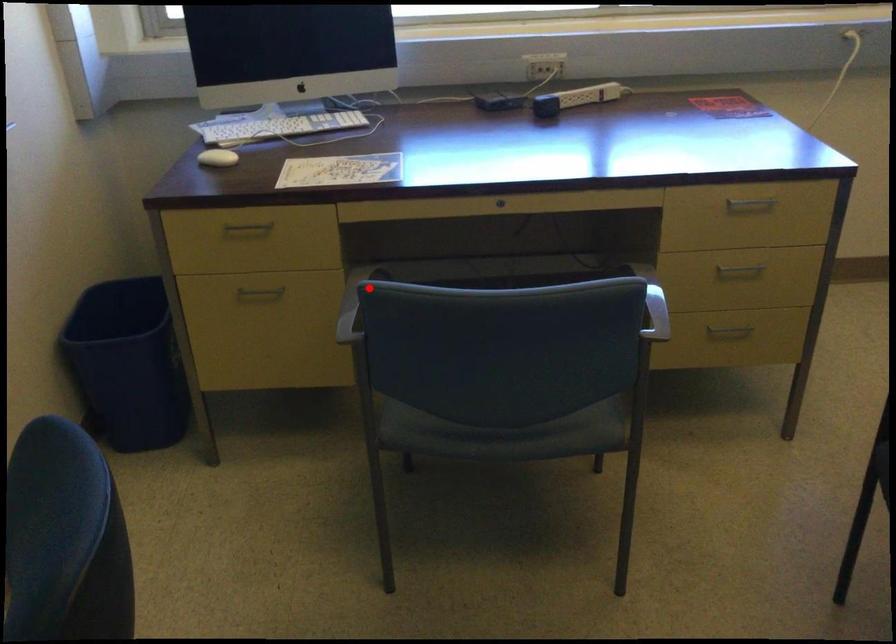
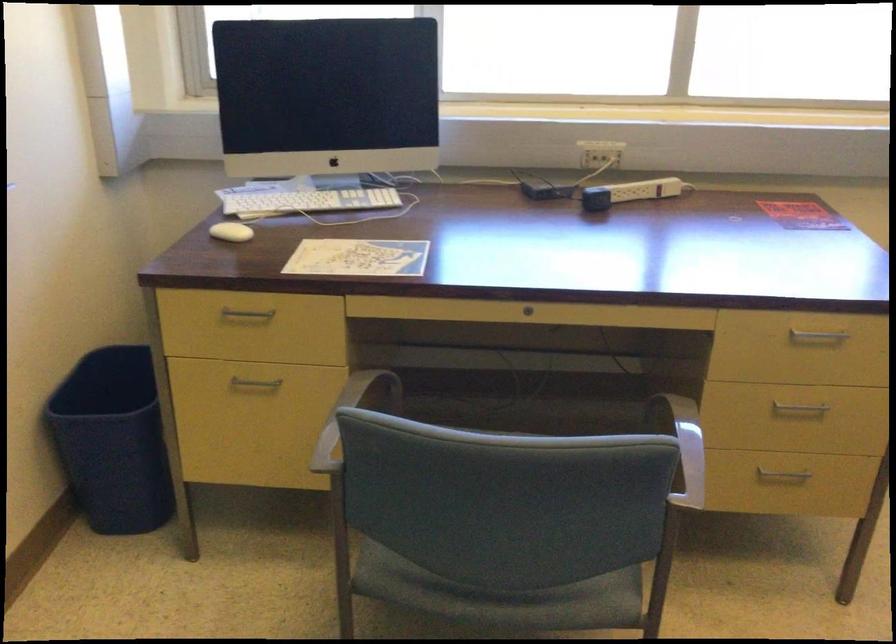
Question: I am providing you with two images of the same scene from different viewpoints. Image1 has a red point marked. In image2, the corresponding 3D location appears at what relative position? Reply with the corresponding letter.

Choices:
 (A) Closer
 (B) Farther

Answer: (A)